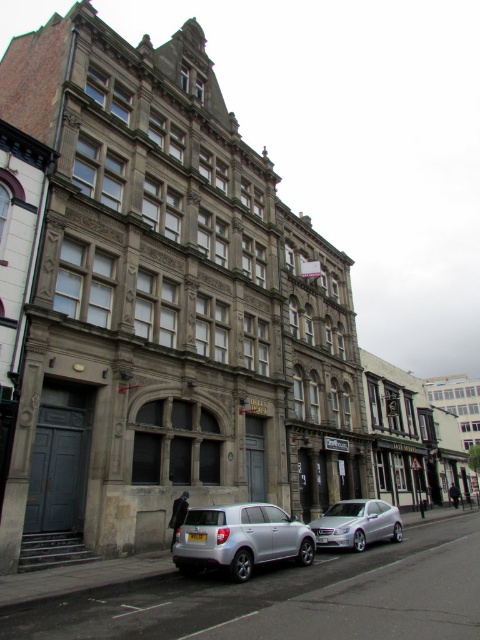
Which is more to the right, satin silver suv at lower center or silver metallic car at center?

From the viewer's perspective, silver metallic car at center appears more on the right side.

Is point (242, 531) positioned before point (385, 506)?

Yes, point (242, 531) is in front of point (385, 506).

Locate an element on the screen. Image resolution: width=480 pixels, height=640 pixels. satin silver suv at lower center is located at coordinates (240, 538).